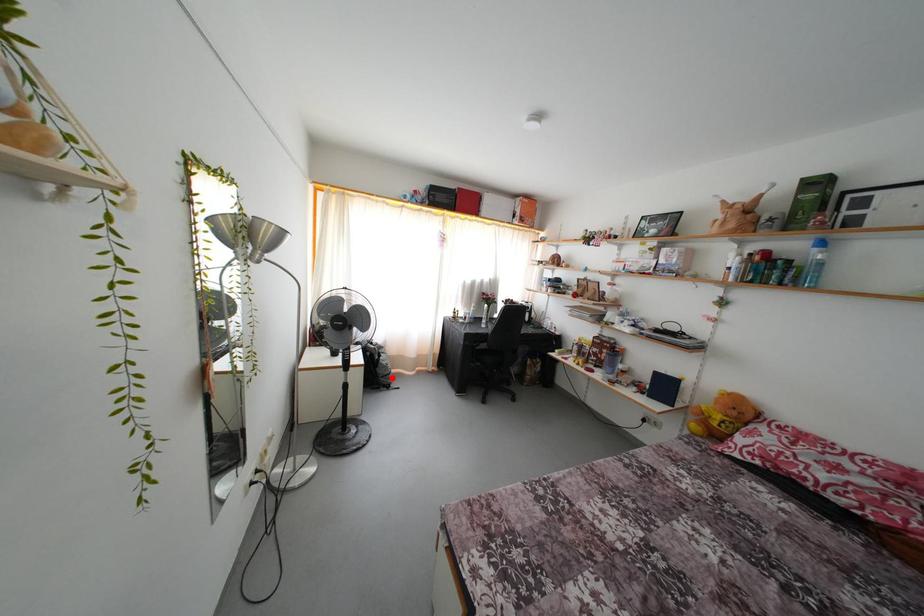
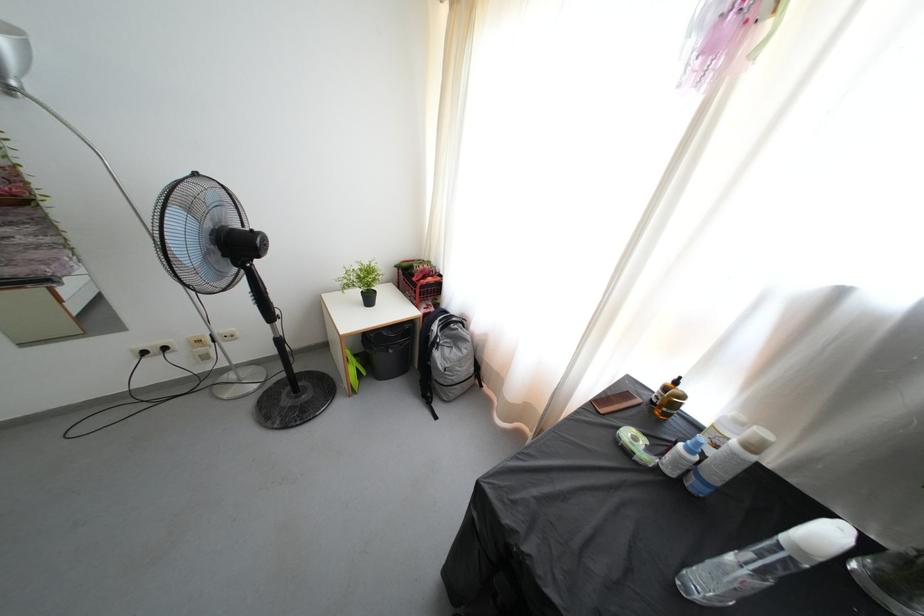
Locate, in the second image, the point that corresponds to the highlighted location in the first image.

(445, 387)